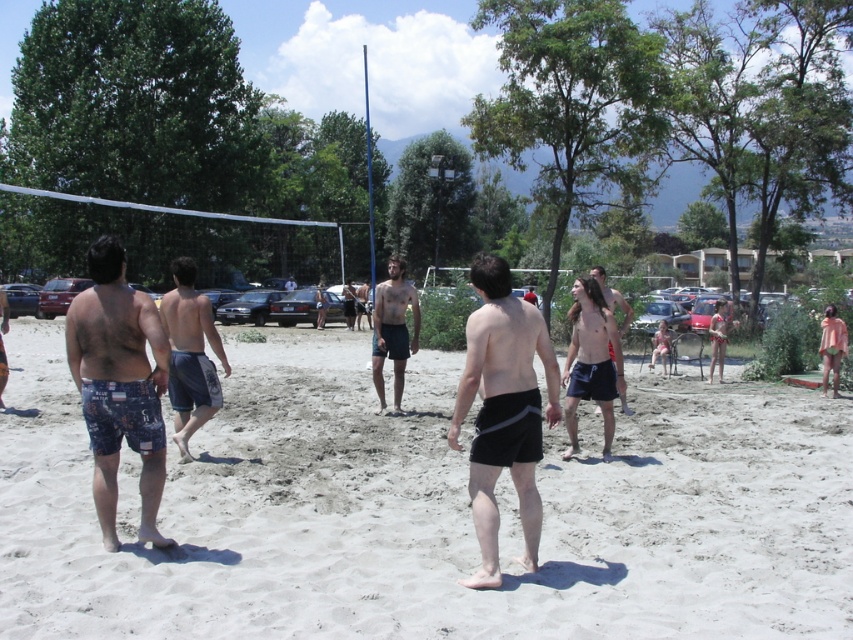
You are a photographer trying to capture a shot of the white sandy beach at center and the shiny black shorts at center. Based on the scene, which object would you need to frame wider to include both in the shot?

The white sandy beach at center might be wider than shiny black shorts at center, so you should frame the shot to accommodate the width of the beach to include both objects.

What is the exact coordinate of the white sandy beach at center?

The white sandy beach at center is located at point (425, 509).